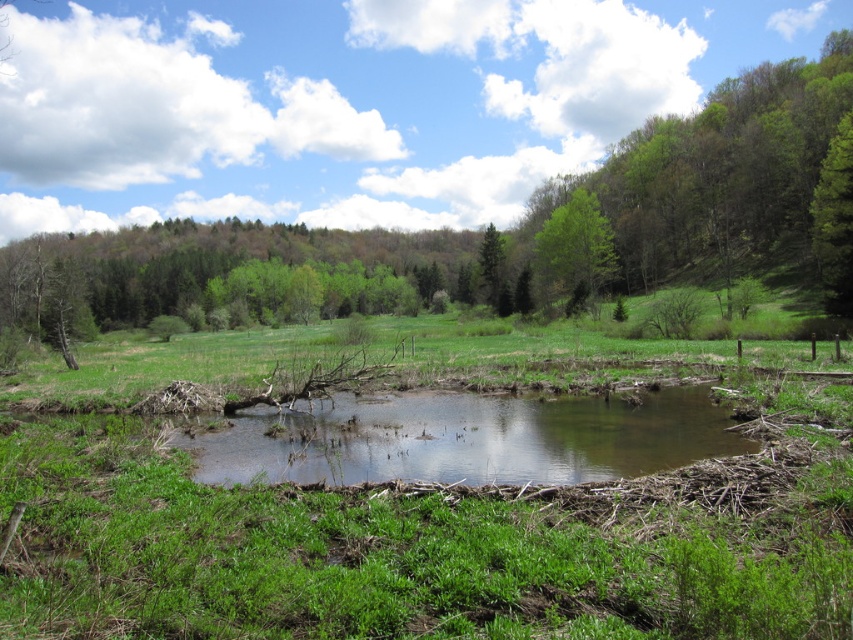
Question: Which point is closer to the camera?

Choices:
 (A) green matte tree at upper right
 (B) green leafy tree at upper center
 (C) green matte tree at center

Answer: (A)

Question: Is brown muddy stream at center positioned behind green matte tree at center?

Choices:
 (A) yes
 (B) no

Answer: (B)

Question: Can you confirm if brown muddy stream at center is positioned to the right of green matte tree at upper right?

Choices:
 (A) no
 (B) yes

Answer: (A)

Question: Among these points, which one is farthest from the camera?

Choices:
 (A) (509, 310)
 (B) (828, 131)

Answer: (A)

Question: Is green leafy tree at upper center wider than green matte tree at center?

Choices:
 (A) yes
 (B) no

Answer: (A)

Question: Which object is the farthest from the green leafy tree at upper center?

Choices:
 (A) green leafy tree at center
 (B) green matte tree at upper right
 (C) brown muddy stream at center

Answer: (C)